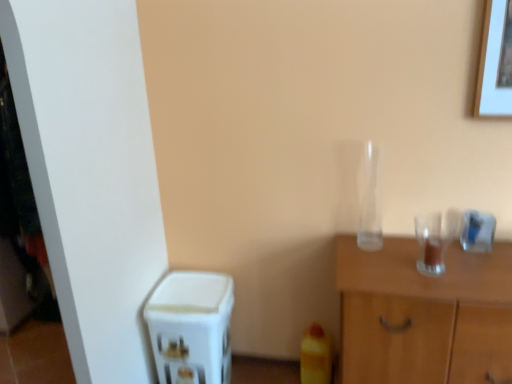
Locate an element on the screen. The height and width of the screenshot is (384, 512). blank space situated above white plastic water dispenser at lower left (from a real-world perspective) is located at coordinates (186, 290).